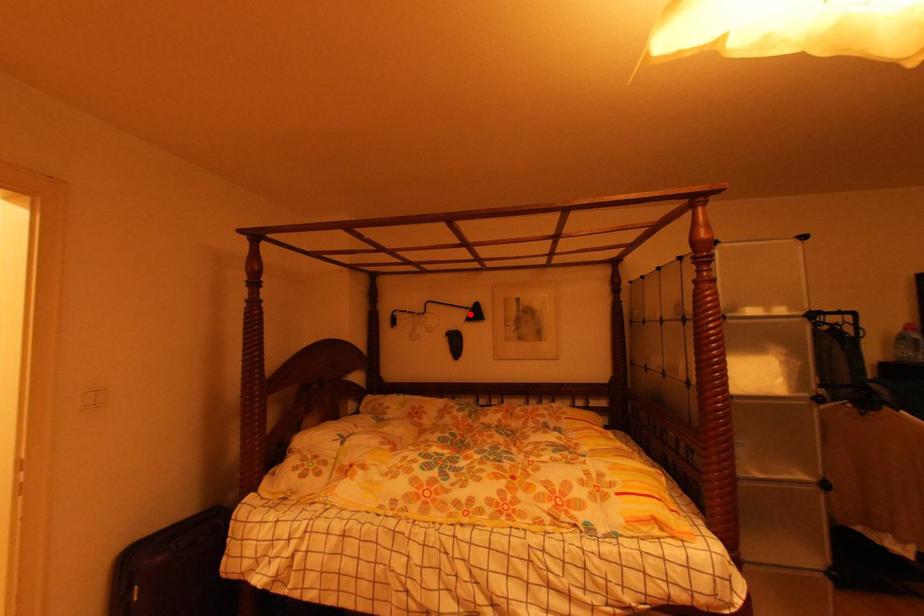
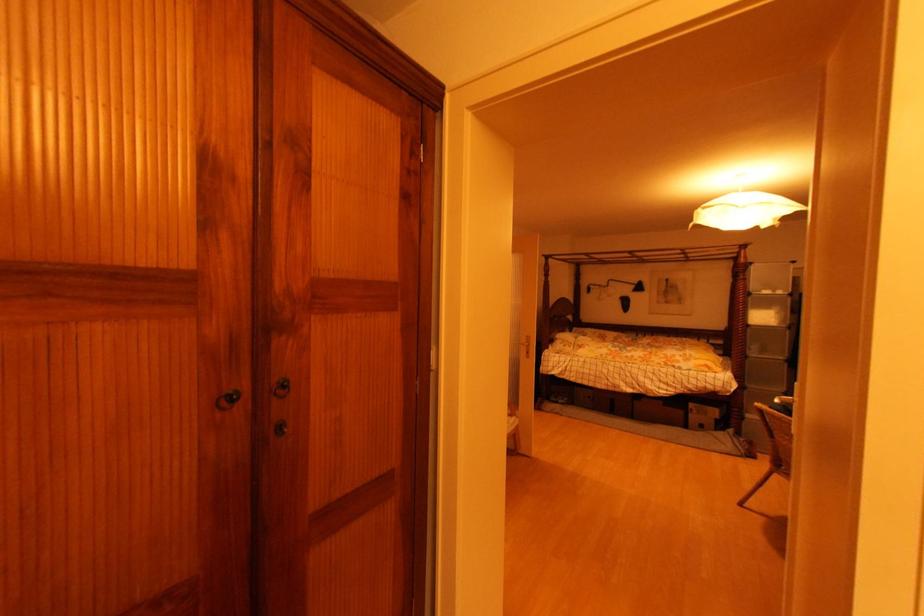
Where in the second image is the point corresponding to the highlighted location from the first image?

(638, 288)